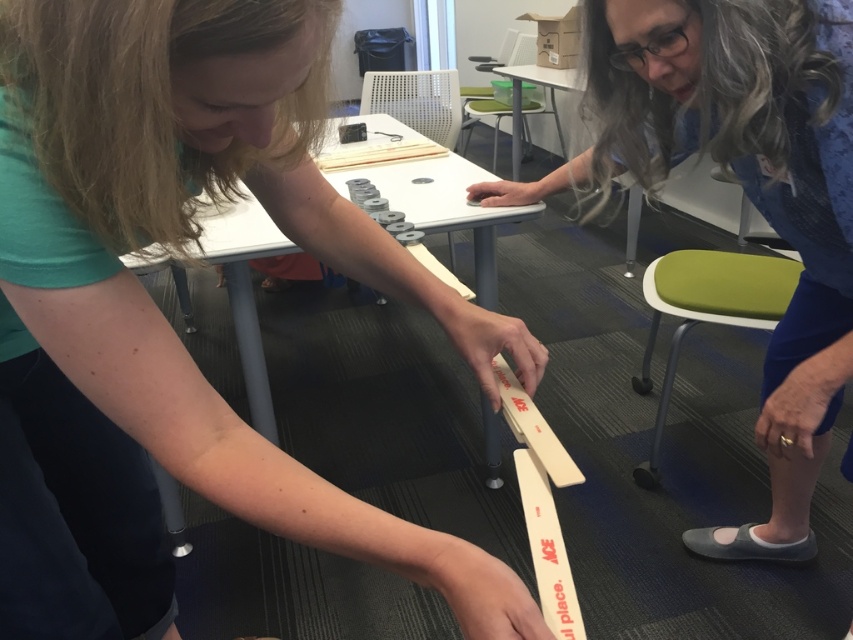
You are a student in a classroom and need to measure a line for a project. You have access to the matte white ruler at lower center and the wooden ruler at center. Which ruler is more suitable if you need a thinner tool to fit into tight spaces?

The matte white ruler at lower center is thinner than the wooden ruler at center, so it is more suitable for fitting into tight spaces.

You are standing at the origin point of the coordinate system in the image. The origin is at the bottom left corner of the image. You need to move towards the matte white ruler at lower center. What direction should you move in?

The matte white ruler at lower center is located at coordinate point (194, 234). Since the origin is at the bottom left corner, moving towards the right along the x axis and slightly upwards along the y axis will reach the ruler.

You are an observer looking at the scene. You see the matte white ruler at lower center and the wooden ruler at center. Which ruler is positioned more to the left?

The matte white ruler at lower center is positioned to the left of the wooden ruler at center, so it is more to the left.